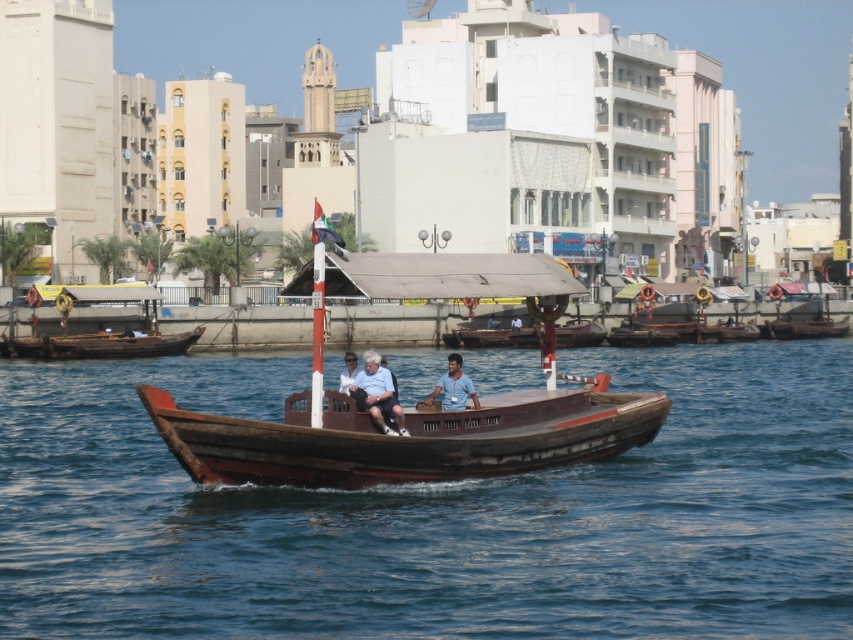
Does wooden boat at left appear on the left side of matte black shirt at center?

Correct, you'll find wooden boat at left to the left of matte black shirt at center.

Is point (78, 301) positioned behind point (380, 422)?

Yes, it is behind point (380, 422).

Which is in front, point (126, 324) or point (386, 394)?

Point (386, 394) is more forward.

Find the location of a particular element. This screenshot has height=640, width=853. wooden boat at left is located at coordinates (102, 330).

Is wooden boat at center thinner than blue fabric shirt at center?

In fact, wooden boat at center might be wider than blue fabric shirt at center.

Does wooden boat at center appear on the right side of blue fabric shirt at center?

Correct, you'll find wooden boat at center to the right of blue fabric shirt at center.

Who is more distant from viewer, (517, 346) or (456, 358)?

Positioned behind is point (517, 346).

Locate an element on the screen. wooden boat at center is located at coordinates (495, 337).

Is point (97, 285) more distant than point (525, 340)?

No.

Does wooden boat at left appear on the left side of wooden boat at center?

Correct, you'll find wooden boat at left to the left of wooden boat at center.

Does point (67, 292) lie in front of point (445, 340)?

Yes, it is in front of point (445, 340).

The image size is (853, 640). In order to click on wooden boat at left in this screenshot , I will do `click(102, 330)`.